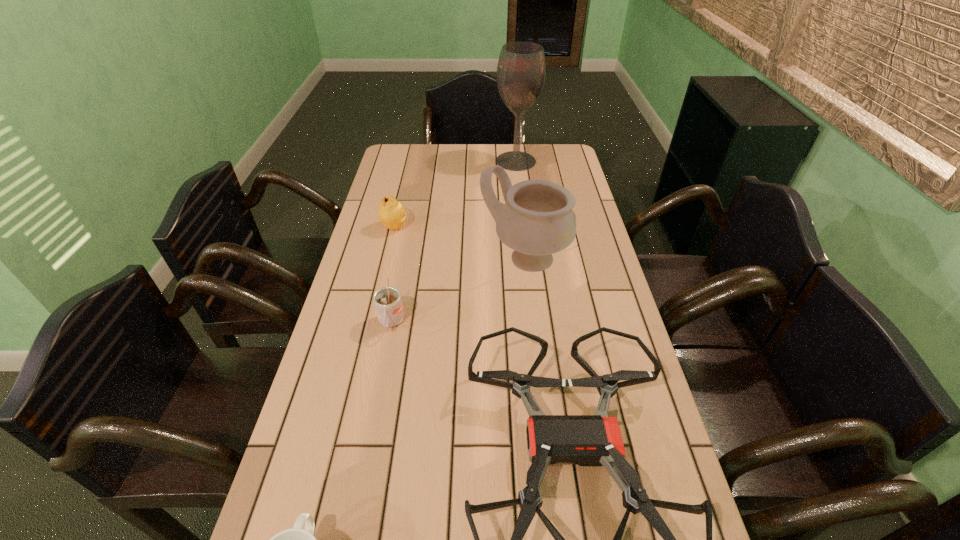
I want to click on the tallest object, so click(521, 70).

This screenshot has width=960, height=540. Identify the location of alcohol. (521, 70).

I want to click on the second tallest object, so click(x=537, y=220).

Identify the location of pear. The height and width of the screenshot is (540, 960). (391, 213).

In order to click on the farther cup in this screenshot , I will do `click(387, 300)`.

Locate an element on the screen. This screenshot has width=960, height=540. vacant area situated on the right of the tallest object is located at coordinates (561, 161).

The width and height of the screenshot is (960, 540). I want to click on vacant space located on the left of the second tallest object, so click(429, 259).

Image resolution: width=960 pixels, height=540 pixels. In order to click on blank space located 0.140m on the back of the pear in this screenshot , I will do `click(401, 196)`.

Identify the location of vacant space located 0.140m on the side with the handle of the third nearest object. This screenshot has width=960, height=540. (378, 388).

I want to click on object that is at the far edge, so click(521, 70).